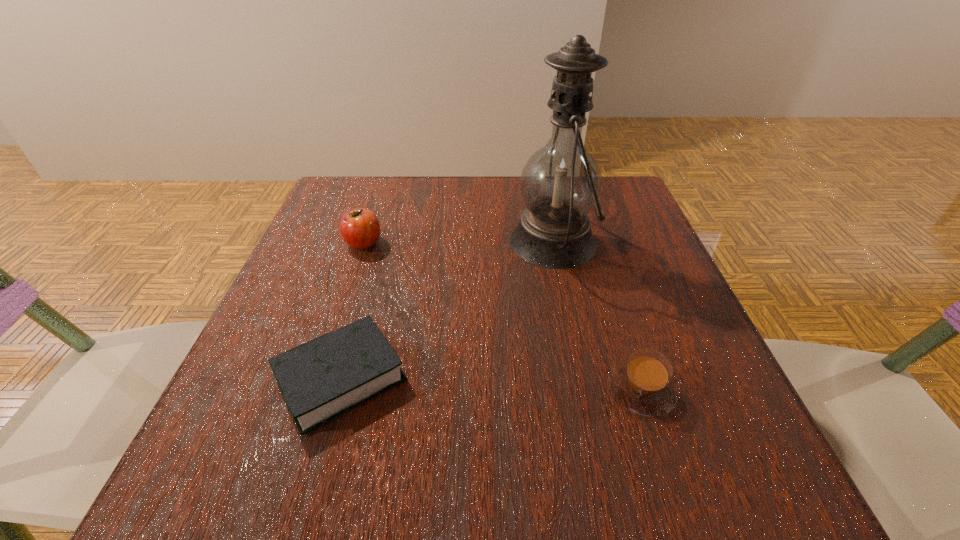
The image size is (960, 540). Find the location of `Bible situated at the left edge`. Bible situated at the left edge is located at coordinates (330, 375).

What are the coordinates of `oil lamp that is at the right edge` in the screenshot? It's located at (560, 183).

This screenshot has width=960, height=540. I want to click on cappuccino at the right edge, so click(643, 384).

The height and width of the screenshot is (540, 960). I want to click on object that is at the far right corner, so tap(560, 183).

The height and width of the screenshot is (540, 960). Find the location of `free region at the far edge`. free region at the far edge is located at coordinates (408, 194).

At what (x,y) coordinates should I click in order to perform the action: click on blank space at the near edge of the desktop. Please return your answer as a coordinate pair (x, y). This screenshot has width=960, height=540. Looking at the image, I should click on (438, 470).

Image resolution: width=960 pixels, height=540 pixels. I want to click on free space at the left edge of the desktop, so click(x=276, y=425).

The image size is (960, 540). Identify the location of free space at the right edge. (603, 267).

In the image, there is a desktop. Identify the location of free region at the far left corner. (357, 203).

This screenshot has height=540, width=960. Find the location of `unoccupied area between the apple and the tallest object`. unoccupied area between the apple and the tallest object is located at coordinates (458, 242).